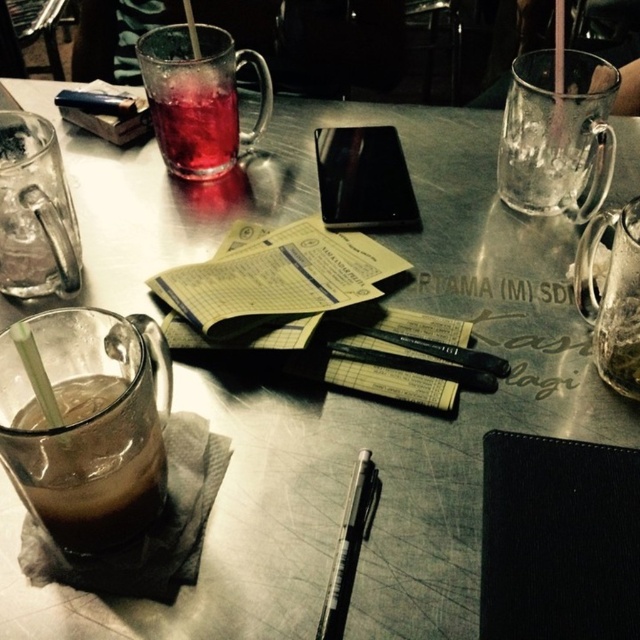
Question: Does black leather notebook at lower right appear on the left side of translucent glass beverage at center?

Choices:
 (A) yes
 (B) no

Answer: (B)

Question: Does black leather notebook at lower right appear on the right side of translucent glass beverage at center?

Choices:
 (A) yes
 (B) no

Answer: (A)

Question: Which point appears farthest from the camera in this image?

Choices:
 (A) (637, 512)
 (B) (60, 417)
 (C) (342, 547)

Answer: (C)

Question: Among these objects, which one is farthest from the camera?

Choices:
 (A) black leather notebook at lower right
 (B) translucent glass beverage at center
 (C) brown frothy drink at lower left

Answer: (B)

Question: Is translucent glass beverage at center in front of clear plastic straw at lower left?

Choices:
 (A) no
 (B) yes

Answer: (A)

Question: Among these objects, which one is nearest to the camera?

Choices:
 (A) black metallic pen at center
 (B) yellow paper notebook at center
 (C) clear plastic straw at lower left

Answer: (C)